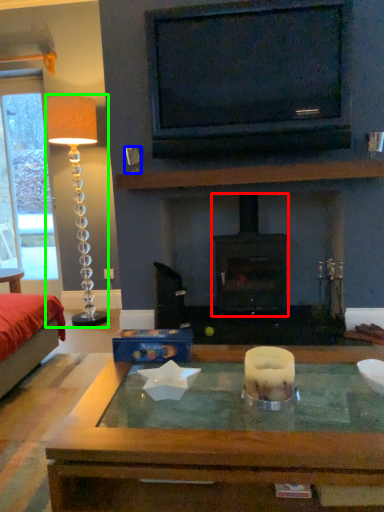
Question: Which object is positioned farthest from wood burning stove (highlighted by a red box)? Select from coffee cup (highlighted by a blue box) and lamp (highlighted by a green box).

Choices:
 (A) coffee cup
 (B) lamp

Answer: (B)